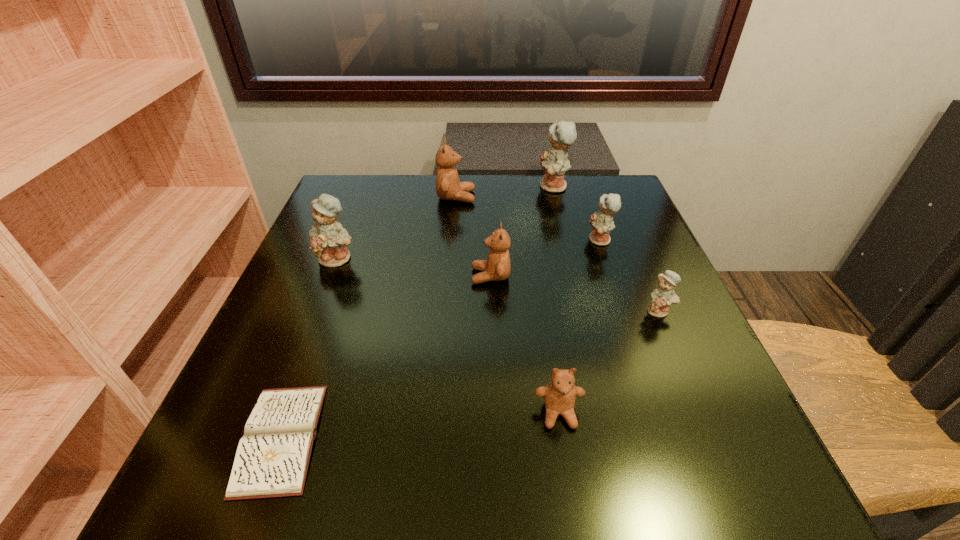
Where is `object situated at the near left corner`? This screenshot has width=960, height=540. object situated at the near left corner is located at coordinates (272, 458).

Find the location of `object positioned at the far right corner`. object positioned at the far right corner is located at coordinates (555, 163).

At what (x,y) coordinates should I click in order to perform the action: click on blank space at the far edge of the desktop. Please return your answer as a coordinate pair (x, y). Looking at the image, I should click on (462, 175).

The height and width of the screenshot is (540, 960). In order to click on vacant point at the near edge in this screenshot , I will do `click(532, 460)`.

The image size is (960, 540). In order to click on vacant space at the left edge of the desktop in this screenshot , I will do `click(348, 348)`.

Locate an element on the screen. vacant space at the right edge is located at coordinates (586, 251).

In the image, there is a desktop. Where is `free space at the far left corner`? The image size is (960, 540). free space at the far left corner is located at coordinates (384, 188).

At what (x,y) coordinates should I click in order to perform the action: click on free space at the far right corner of the desktop. Please return your answer as a coordinate pair (x, y). The image size is (960, 540). Looking at the image, I should click on point(620,190).

Locate an element on the screen. This screenshot has width=960, height=540. free space at the near right corner is located at coordinates (764, 511).

This screenshot has width=960, height=540. I want to click on unoccupied area between the leftmost teddy bear and the nearest teddy bear, so click(448, 336).